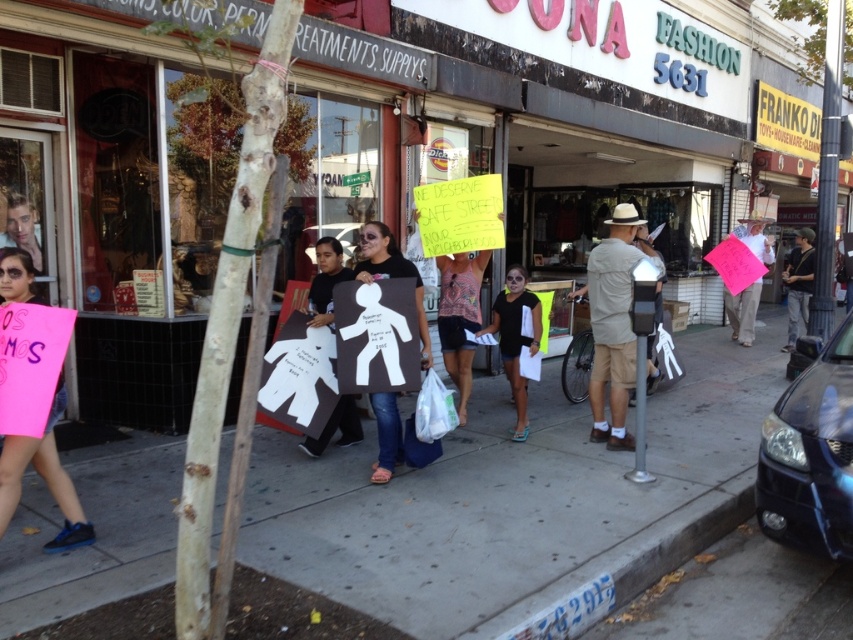
You are a photographer trying to capture a closeup of the beige cotton shirt at center and the matte black shorts at center. Since the camera can only focus on one object at a time, which object should you focus on first to ensure the wider object is in focus?

The matte black shorts at center is wider than the beige cotton shirt at center, so you should focus on the matte black shorts at center first to ensure the wider object is in focus.

You are a delivery person carrying a box that is 2 meters long. You need to move from the pink paper sign at left to the concrete sidewalk at center. Is the space between them wide enough to carry your box without tilting it sideways?

The distance between the pink paper sign at left and the concrete sidewalk at center is 2.51 meters. Since the box is 2 meters long, the space is sufficient for you to carry the box straight without tilting it sideways.